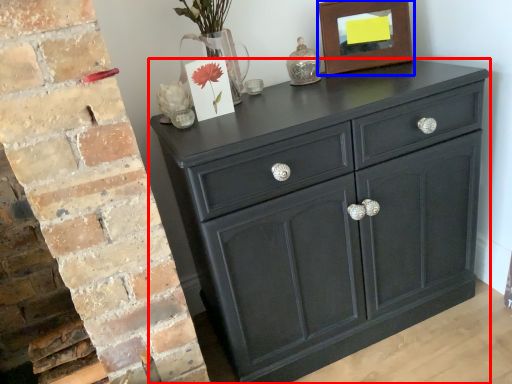
Question: Among these objects, which one is farthest to the camera, chest of drawers (highlighted by a red box) or picture frame (highlighted by a blue box)?

Choices:
 (A) chest of drawers
 (B) picture frame

Answer: (B)